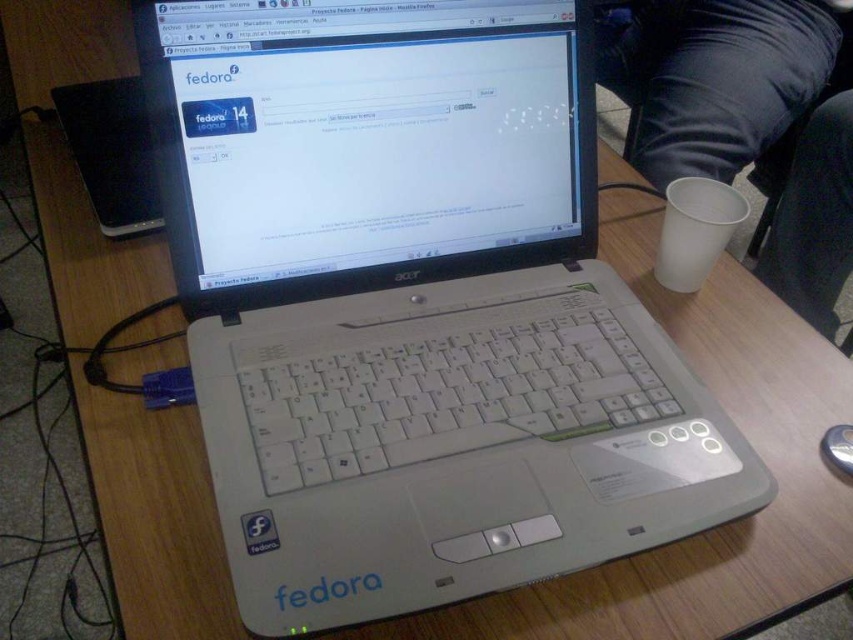
You are sitting at a wooden table with a laptop and a disposable cup nearby. You need to place a 2.5 feet long document on the table without covering the laptop or the cup. Is there enough space between the black fabric lap at upper right and the edge of the table to place the document horizontally?

The black fabric lap at upper right is 3.34 feet away from the viewer. Since the document is 2.5 feet long, there is sufficient space between the black fabric lap at upper right and the table edge to place the document horizontally without covering the laptop or the cup.

You are trying to locate your mouse while working on the laptop. The laptop is on the table, and you see the black fabric lap at upper right and the silver metallic mouse at lower right. Which object is positioned to the right of the other?

The black fabric lap at upper right is to the right of the silver metallic mouse at lower right according to the description.